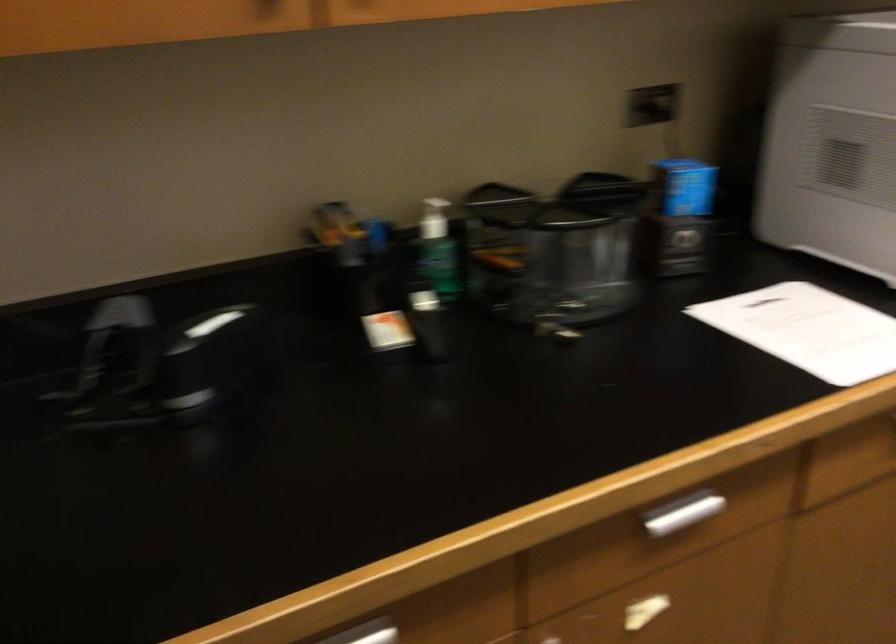
The image size is (896, 644). What do you see at coordinates (684, 187) in the screenshot?
I see `the blue box` at bounding box center [684, 187].